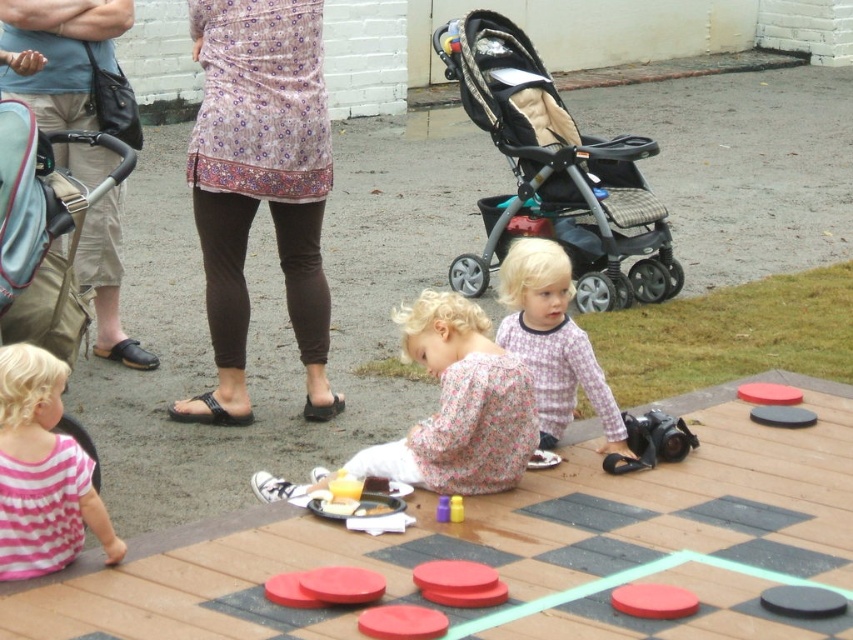
You are standing at point [457,502] and want to walk to point [28,26]. Which direction should you move?

You should move forward because point [28,26] is behind point [457,502], so moving forward from [457,502] will lead you to [28,26].

You are a photographer at the event and need to capture a closeup of the smooth red disc at center without including the printed cotton tunic at center. Given their sizes, is this feasible?

The printed cotton tunic at center is wider than the smooth red disc at center. Since the tunic is larger, positioning the camera to focus solely on the disc while excluding the tunic might be challenging due to their size difference.

You are a photographer at the event and want to capture a clear shot of both the floral cotton shirt at center and the rubber duck at center. Since the camera can only focus on one subject at a time, which object should you focus on to ensure the other is still somewhat in focus?

The floral cotton shirt at center is taller than the rubber duck at center, so focusing on the taller object, the floral cotton shirt at center, would allow the shorter rubber duck at center to remain somewhat in focus.